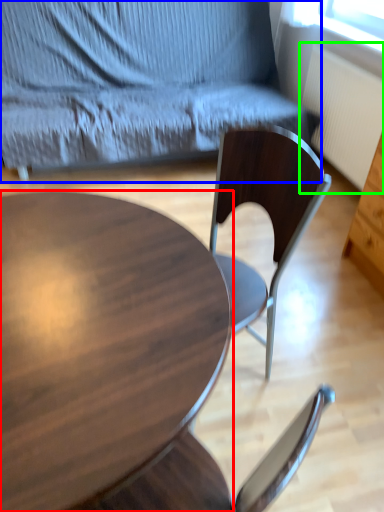
Question: Which object is the farthest from coffee table (highlighted by a red box)? Choose among these: chair (highlighted by a blue box) or radiator (highlighted by a green box).

Choices:
 (A) chair
 (B) radiator

Answer: (B)